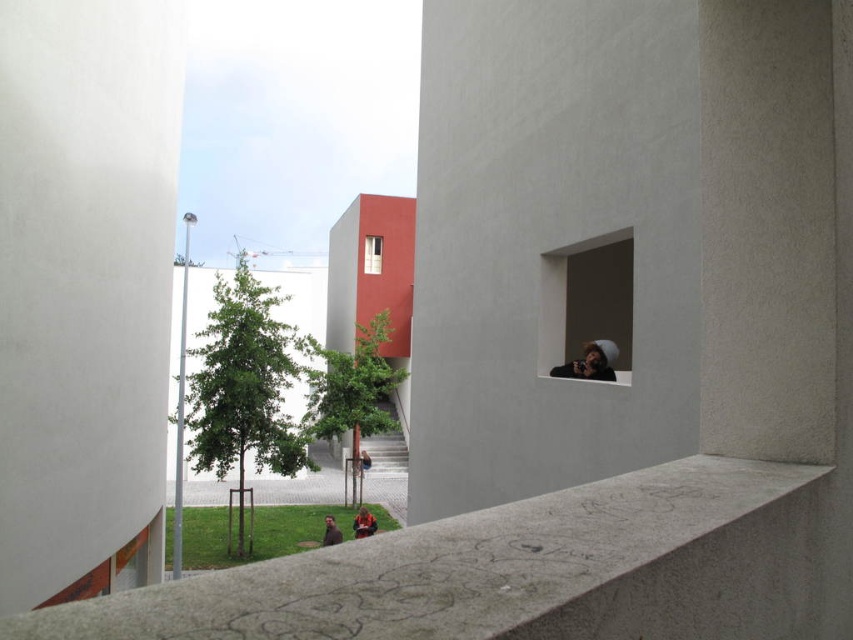
Measure the distance between concrete ledge at lower center and matte glass window at center.

The distance of concrete ledge at lower center from matte glass window at center is 29.55 meters.

Does concrete ledge at lower center have a smaller size compared to matte glass window at center?

Actually, concrete ledge at lower center might be larger than matte glass window at center.

You are a GUI agent. You are given a task and a screenshot of the screen. Output one action in this format:
    pyautogui.click(x=<x>, y=<y>)
    Task: Click on the concrete ledge at lower center
    
    Given the screenshot: What is the action you would take?
    pyautogui.click(x=514, y=570)

This screenshot has height=640, width=853. What are the coordinates of `concrete ledge at lower center` in the screenshot? It's located at (514, 570).

This screenshot has height=640, width=853. Identify the location of matte gray window at upper right. (x=587, y=305).

Does point (604, 353) come closer to viewer compared to point (331, 528)?

Yes, point (604, 353) is closer to viewer.

Does point (624, 259) come behind point (334, 536)?

No, it is in front of (334, 536).

Find the location of `matte gray window at upper right`. matte gray window at upper right is located at coordinates (587, 305).

Between point (590, 342) and point (340, 538), which one is positioned behind?

Point (340, 538)

Is matte black camera at upper right taller than brown leather jacket at lower center?

Correct, matte black camera at upper right is much taller as brown leather jacket at lower center.

Which is behind, point (608, 368) or point (325, 516)?

The point (325, 516) is behind.

Find the location of a particular element. This screenshot has height=640, width=853. matte black camera at upper right is located at coordinates (590, 362).